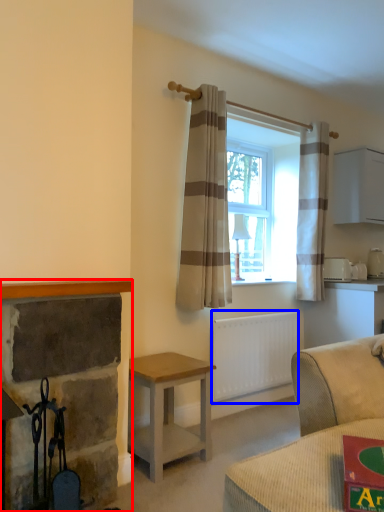
Question: Among these objects, which one is nearest to the camera, fireplace (highlighted by a red box) or radiator (highlighted by a blue box)?

Choices:
 (A) fireplace
 (B) radiator

Answer: (A)